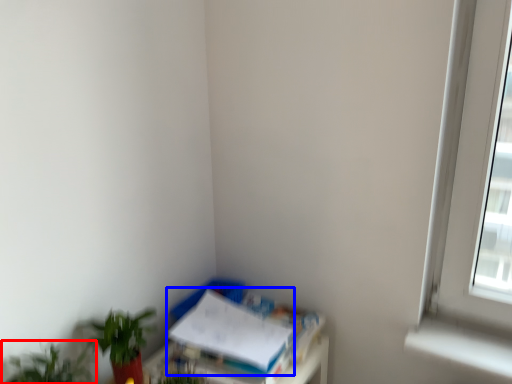
Question: Among these objects, which one is nearest to the camera, houseplant (highlighted by a red box) or paperback book (highlighted by a blue box)?

Choices:
 (A) houseplant
 (B) paperback book

Answer: (A)